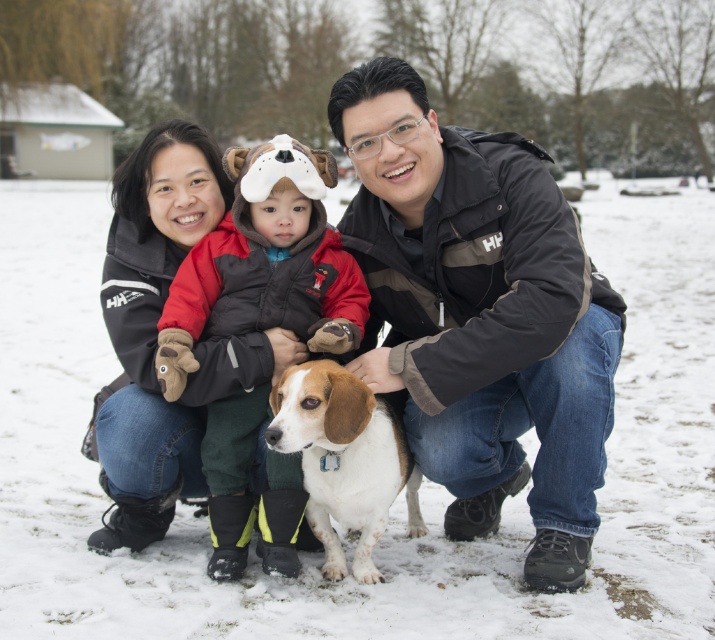
Does velvet brown vest at center appear over brown and white fur dog at center?

Correct, velvet brown vest at center is located above brown and white fur dog at center.

Who is taller, velvet brown vest at center or brown and white fur dog at center?

Standing taller between the two is velvet brown vest at center.

Between point (162, 388) and point (383, 403), which one is positioned behind?

The point (383, 403) is behind.

Find the location of `velvet brown vest at center`. velvet brown vest at center is located at coordinates (265, 264).

Between black jacket at center and brown and white fur dog at center, which one is positioned lower?

brown and white fur dog at center

Between black jacket at center and brown and white fur dog at center, which one appears on the left side from the viewer's perspective?

From the viewer's perspective, brown and white fur dog at center appears more on the left side.

Does point (355, 134) come closer to viewer compared to point (315, 484)?

No, (355, 134) is further to viewer.

Find the location of a particular element. This screenshot has width=715, height=640. black jacket at center is located at coordinates (480, 314).

Does white fluffy snow at center appear on the right side of velvet brown vest at center?

Indeed, white fluffy snow at center is positioned on the right side of velvet brown vest at center.

Can you confirm if white fluffy snow at center is positioned below velvet brown vest at center?

No.

This screenshot has height=640, width=715. What do you see at coordinates (398, 496) in the screenshot? I see `white fluffy snow at center` at bounding box center [398, 496].

Locate an element on the screen. Image resolution: width=715 pixels, height=640 pixels. white fluffy snow at center is located at coordinates (398, 496).